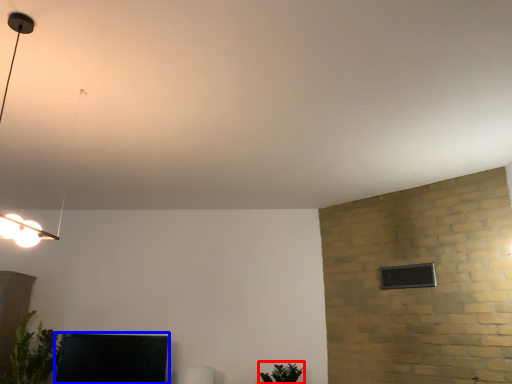
Question: Which of the following is the farthest to the observer, plant (highlighted by a red box) or furniture (highlighted by a blue box)?

Choices:
 (A) plant
 (B) furniture

Answer: (B)